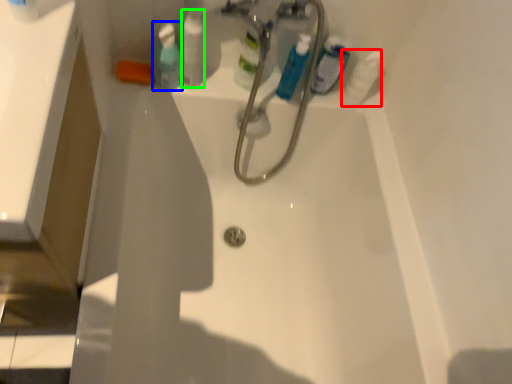
Question: Which is farther away from cleaning product (highlighted by a red box)? mouthwash (highlighted by a blue box) or toiletry (highlighted by a green box)?

Choices:
 (A) mouthwash
 (B) toiletry

Answer: (A)